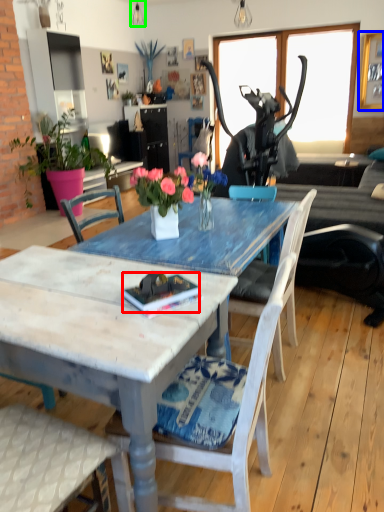
Question: Which object is the closest to the book (highlighted by a red box)? Choose among these: picture frame (highlighted by a blue box) or lamp (highlighted by a green box).

Choices:
 (A) picture frame
 (B) lamp

Answer: (A)